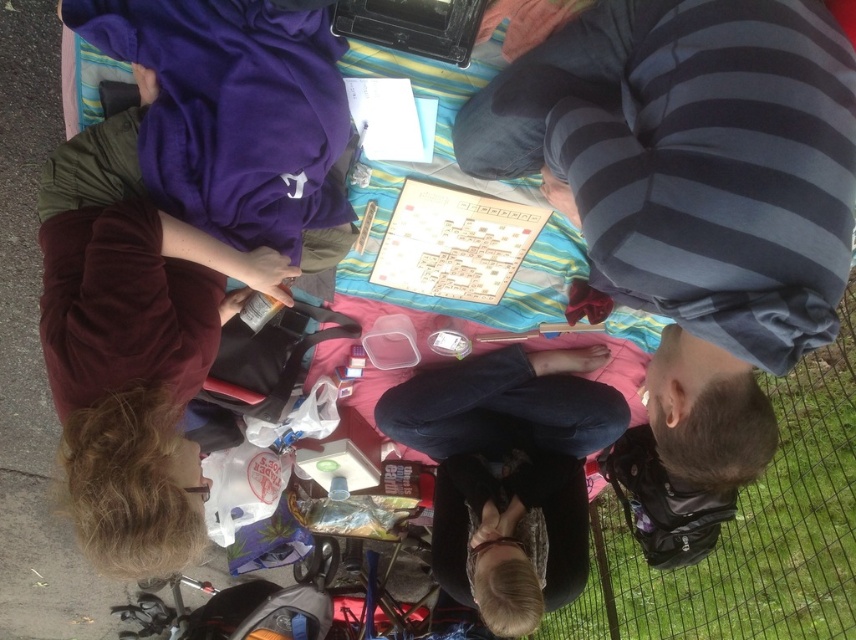
Does dark blue jeans at center have a smaller size compared to wooden picnic table at center?

Indeed, dark blue jeans at center has a smaller size compared to wooden picnic table at center.

Does dark blue jeans at center lie in front of wooden picnic table at center?

Yes, dark blue jeans at center is in front of wooden picnic table at center.

The width and height of the screenshot is (856, 640). I want to click on dark blue jeans at center, so click(510, 472).

Which is more to the left, striped cotton shirt at upper right or dark blue jeans at center?

dark blue jeans at center is more to the left.

Does point (831, 113) come behind point (581, 531)?

No, (831, 113) is in front of (581, 531).

Identify the location of striped cotton shirt at upper right. The image size is (856, 640). (693, 193).

How much distance is there between striped cotton shirt at upper right and wooden picnic table at center?

The distance of striped cotton shirt at upper right from wooden picnic table at center is 1.74 meters.

Can you confirm if striped cotton shirt at upper right is positioned to the left of wooden picnic table at center?

No, striped cotton shirt at upper right is not to the left of wooden picnic table at center.

Between point (755, 476) and point (352, 616), which one is positioned in front?

Point (755, 476)

Locate an element on the screen. The width and height of the screenshot is (856, 640). striped cotton shirt at upper right is located at coordinates (693, 193).